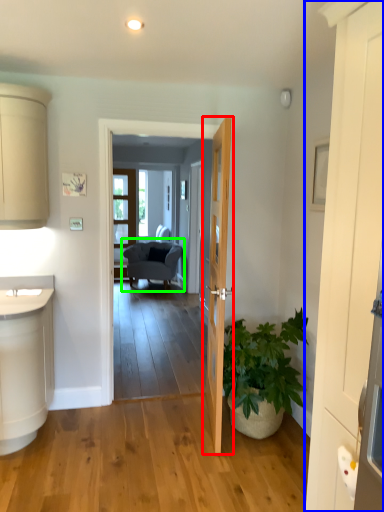
Question: Considering the real-world distances, which object is farthest from door (highlighted by a red box)? door (highlighted by a blue box) or chair (highlighted by a green box)?

Choices:
 (A) door
 (B) chair

Answer: (B)